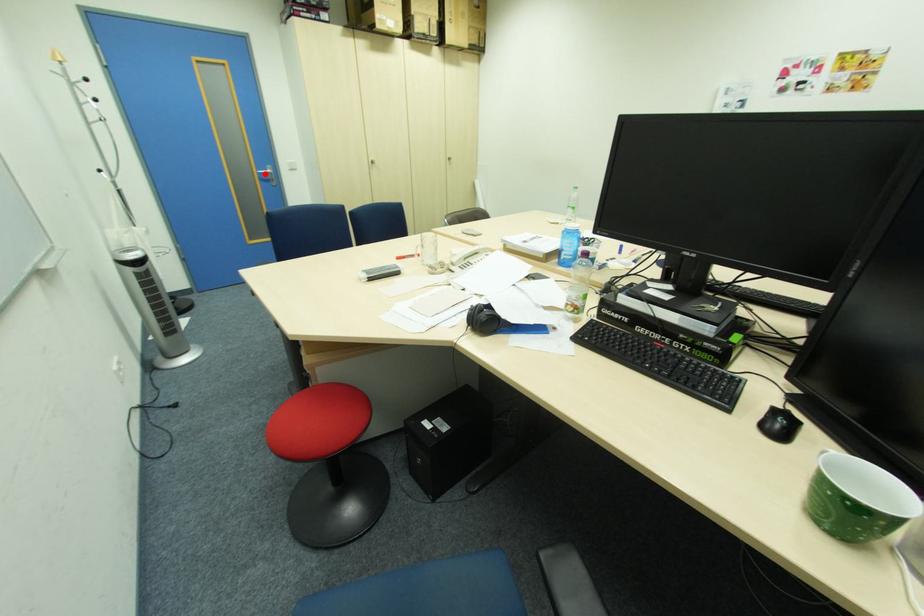
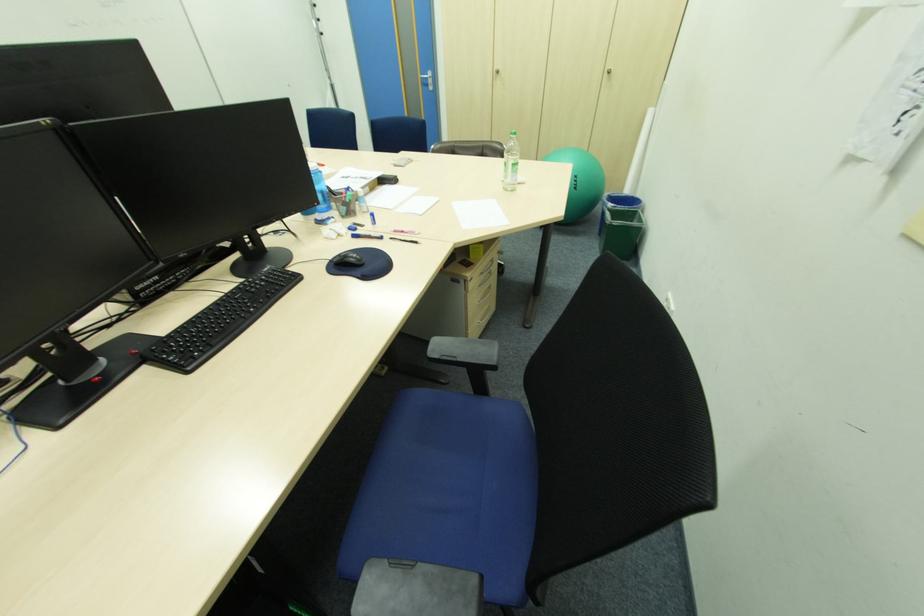
The point at the highlighted location is marked in the first image. Where is the corresponding point in the second image?

(428, 79)